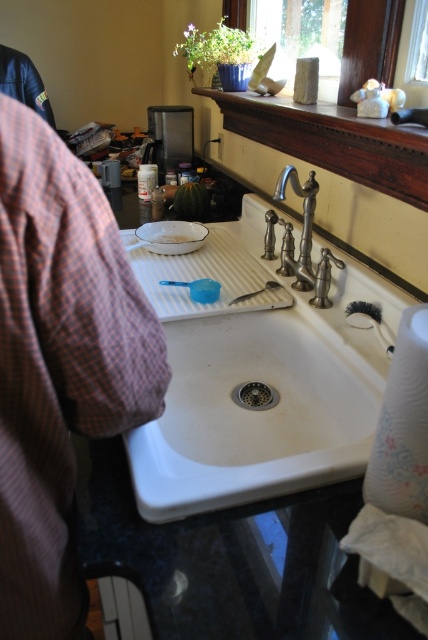
Question: Estimate the real-world distances between objects in this image. Which object is closer to the white ceramic sink at center?

Choices:
 (A) polished chrome faucet at center
 (B) white matte plate at center
 (C) brown checkered shirt at left

Answer: (A)

Question: Can you confirm if brown checkered shirt at left is positioned to the left of polished chrome faucet at center?

Choices:
 (A) yes
 (B) no

Answer: (A)

Question: Is brown checkered shirt at left behind white ceramic sink at center?

Choices:
 (A) no
 (B) yes

Answer: (A)

Question: Is white ceramic sink at center to the left of white paper at right from the viewer's perspective?

Choices:
 (A) yes
 (B) no

Answer: (A)

Question: Which point is farther to the camera?

Choices:
 (A) brown checkered shirt at left
 (B) white ceramic sink at center

Answer: (B)

Question: Among these objects, which one is farthest from the camera?

Choices:
 (A) white matte plate at center
 (B) brown checkered shirt at left
 (C) metallic silver drain at center
 (D) white ceramic sink at center

Answer: (A)